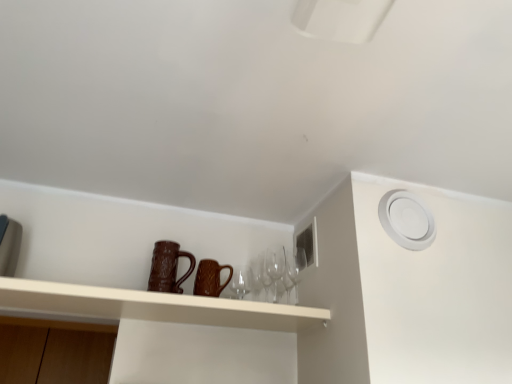
Question: Can you confirm if matte brown mugs at center is thinner than transparent glass wine glass at center, the second wine glass when ordered from left to right?

Choices:
 (A) no
 (B) yes

Answer: (A)

Question: From a real-world perspective, is matte brown mugs at center located beneath transparent glass wine glass at center, the second wine glass when ordered from left to right?

Choices:
 (A) yes
 (B) no

Answer: (A)

Question: Considering the relative sizes of matte brown mugs at center and transparent glass wine glass at center, the second wine glass when ordered from left to right, in the image provided, is matte brown mugs at center smaller than transparent glass wine glass at center, the second wine glass when ordered from left to right,?

Choices:
 (A) no
 (B) yes

Answer: (A)

Question: Is matte brown mugs at center looking in the opposite direction of transparent glass wine glass at center, marked as the first wine glass in a right-to-left arrangement?

Choices:
 (A) yes
 (B) no

Answer: (B)

Question: Is matte brown mugs at center further to camera compared to transparent glass wine glass at center, marked as the first wine glass in a right-to-left arrangement?

Choices:
 (A) no
 (B) yes

Answer: (A)

Question: In terms of width, does brown textured mug at center, acting as the 1th mug starting from the right, look wider or thinner when compared to transparent glass wine glasses at center, the 2th wine glass positioned from the right?

Choices:
 (A) thin
 (B) wide

Answer: (B)

Question: Considering their positions, is brown textured mug at center, the second mug from the left, located in front of or behind transparent glass wine glasses at center, which is counted as the first wine glass, starting from the left?

Choices:
 (A) front
 (B) behind

Answer: (A)

Question: In terms of height, does brown textured mug at center, the second mug from the left, look taller or shorter compared to transparent glass wine glasses at center, which is counted as the first wine glass, starting from the left?

Choices:
 (A) tall
 (B) short

Answer: (B)

Question: In the image, is brown textured mug at center, the second mug from the left, on the left side or the right side of transparent glass wine glasses at center, which is counted as the first wine glass, starting from the left?

Choices:
 (A) left
 (B) right

Answer: (A)

Question: Would you say transparent glass wine glasses at center, the 2th wine glass positioned from the right, is to the left or to the right of brown textured mug at center, marked as the 2th mug in a right-to-left arrangement, in the picture?

Choices:
 (A) left
 (B) right

Answer: (B)

Question: Is transparent glass wine glasses at center, the 2th wine glass positioned from the right, wider or thinner than brown textured mug at center, the 1th mug viewed from the left?

Choices:
 (A) thin
 (B) wide

Answer: (A)

Question: Relative to brown textured mug at center, marked as the 2th mug in a right-to-left arrangement, is transparent glass wine glasses at center, which is counted as the first wine glass, starting from the left, in front or behind?

Choices:
 (A) behind
 (B) front

Answer: (A)

Question: From the image's perspective, is transparent glass wine glasses at center, the 2th wine glass positioned from the right, located above or below brown textured mug at center, the 1th mug viewed from the left?

Choices:
 (A) above
 (B) below

Answer: (B)

Question: From the image's perspective, is matte brown mugs at center above or below brown textured mug at center, acting as the 1th mug starting from the right?

Choices:
 (A) above
 (B) below

Answer: (B)

Question: From a real-world perspective, is matte brown mugs at center physically located above or below brown textured mug at center, the second mug from the left?

Choices:
 (A) above
 (B) below

Answer: (B)